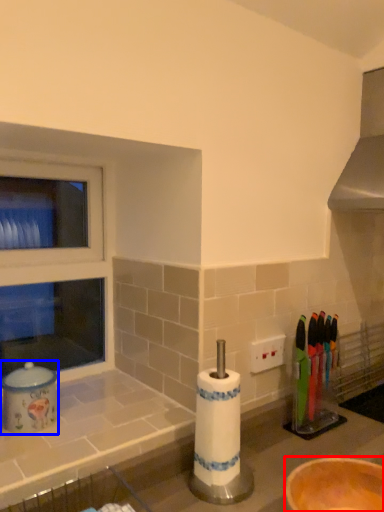
Question: Which object is further to the camera taking this photo, bowl (highlighted by a red box) or appliance (highlighted by a blue box)?

Choices:
 (A) bowl
 (B) appliance

Answer: (B)